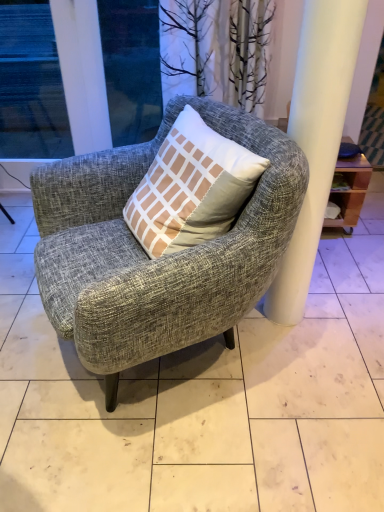
Question: Is transparent glass window at upper left, the second window when ordered from right to left, at the right side of textured gray armchair at center?

Choices:
 (A) yes
 (B) no

Answer: (B)

Question: Is transparent glass window at upper left, which ranks as the 1th window in left-to-right order, thinner than textured gray armchair at center?

Choices:
 (A) yes
 (B) no

Answer: (A)

Question: Is transparent glass window at upper left, the second window when ordered from right to left, positioned with its back to textured gray armchair at center?

Choices:
 (A) no
 (B) yes

Answer: (A)

Question: Is transparent glass window at upper left, the second window when ordered from right to left, to the left of textured gray armchair at center from the viewer's perspective?

Choices:
 (A) no
 (B) yes

Answer: (B)

Question: Is the depth of transparent glass window at upper left, the second window when ordered from right to left, less than that of textured gray armchair at center?

Choices:
 (A) no
 (B) yes

Answer: (A)

Question: Is transparent glass window at upper left, which ranks as the 1th window in left-to-right order, far away from textured gray armchair at center?

Choices:
 (A) yes
 (B) no

Answer: (A)

Question: From the image's perspective, does gray fabric chair at center appear lower than transparent glass window at upper left, the second window when ordered from right to left?

Choices:
 (A) no
 (B) yes

Answer: (B)

Question: Is gray fabric chair at center positioned with its back to transparent glass window at upper left, which ranks as the 1th window in left-to-right order?

Choices:
 (A) no
 (B) yes

Answer: (A)

Question: Is gray fabric chair at center at the left side of transparent glass window at upper left, the second window when ordered from right to left?

Choices:
 (A) no
 (B) yes

Answer: (A)

Question: Does gray fabric chair at center have a lesser height compared to transparent glass window at upper left, the second window when ordered from right to left?

Choices:
 (A) yes
 (B) no

Answer: (A)

Question: Is gray fabric chair at center not near transparent glass window at upper left, the second window when ordered from right to left?

Choices:
 (A) yes
 (B) no

Answer: (A)

Question: Does gray fabric chair at center have a lesser width compared to transparent glass window at upper left, which ranks as the 1th window in left-to-right order?

Choices:
 (A) no
 (B) yes

Answer: (A)

Question: Is textured gray armchair at center to the right of gray fabric chair at center from the viewer's perspective?

Choices:
 (A) yes
 (B) no

Answer: (B)